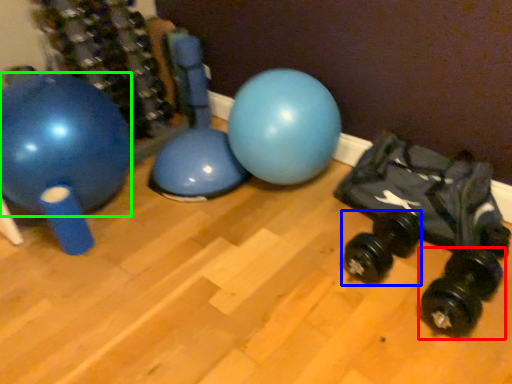
Question: Considering the real-world distances, which object is closest to dumbbell (highlighted by a red box)? dumbbell (highlighted by a blue box) or ball (highlighted by a green box).

Choices:
 (A) dumbbell
 (B) ball

Answer: (A)